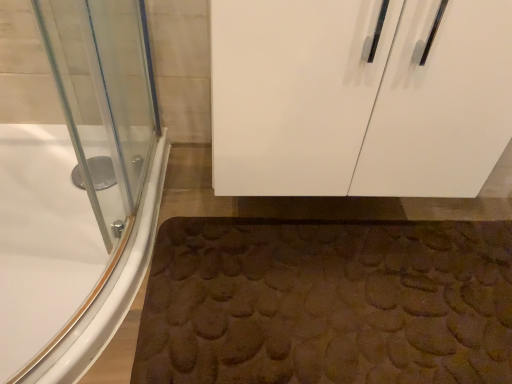
Question: Is point (459, 132) positioned closer to the camera than point (431, 372)?

Choices:
 (A) closer
 (B) farther

Answer: (A)

Question: In terms of width, does white glossy cabinet at upper center look wider or thinner when compared to brown textured bath mat at lower center?

Choices:
 (A) wide
 (B) thin

Answer: (A)

Question: Estimate the real-world distances between objects in this image. Which object is closer to the white glossy cabinet at upper center?

Choices:
 (A) white glossy bathtub at lower left
 (B) brown textured bath mat at lower center

Answer: (B)

Question: Estimate the real-world distances between objects in this image. Which object is closer to the white glossy bathtub at lower left?

Choices:
 (A) white glossy cabinet at upper center
 (B) brown textured bath mat at lower center

Answer: (B)